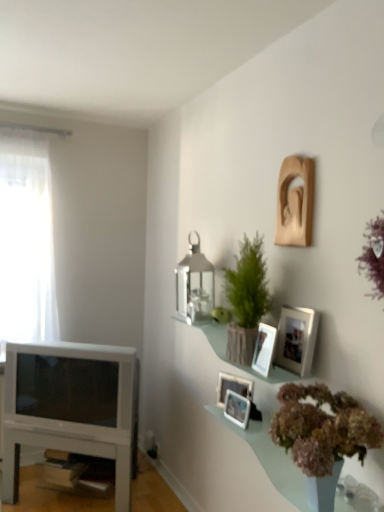
This screenshot has width=384, height=512. What are the coordinates of `silver metallic lantern at upper center` in the screenshot? It's located at (194, 283).

This screenshot has width=384, height=512. Describe the element at coordinates (237, 408) in the screenshot. I see `matte silver picture frame at center, positioned as the 5th picture frame in top-to-bottom order` at that location.

At what (x,y) coordinates should I click in order to perform the action: click on wooden picture frame at upper right, placed as the 3th picture frame when sorted from top to bottom. Please return your answer as a coordinate pair (x, y). Image resolution: width=384 pixels, height=512 pixels. Looking at the image, I should click on (264, 349).

The width and height of the screenshot is (384, 512). Describe the element at coordinates (233, 387) in the screenshot. I see `matte silver picture frame at center, which ranks as the 4th picture frame in top-to-bottom order` at that location.

Image resolution: width=384 pixels, height=512 pixels. What are the coordinates of `wooden sculpture at upper right, which is the 5th picture frame in bottom-to-top order` in the screenshot? It's located at (295, 203).

Find the location of a particular element. This screenshot has height=512, width=384. silver metallic lantern at upper center is located at coordinates (194, 283).

What's the angular difference between wooden picture frame at upper right, placed as the 3th picture frame when sorted from top to bottom, and white glossy table at lower left's facing directions?

60.1 degrees separate the facing orientations of wooden picture frame at upper right, placed as the 3th picture frame when sorted from top to bottom, and white glossy table at lower left.

From a real-world perspective, is wooden picture frame at upper right, which is the 3th picture frame from bottom to top, over white glossy table at lower left?

Yes, from a real-world perspective, wooden picture frame at upper right, which is the 3th picture frame from bottom to top, is above white glossy table at lower left.

Would you say wooden picture frame at upper right, placed as the 3th picture frame when sorted from top to bottom, is outside white glossy table at lower left?

Indeed, wooden picture frame at upper right, placed as the 3th picture frame when sorted from top to bottom, is completely outside white glossy table at lower left.

Is matte silver picture frame at center, positioned as the 5th picture frame in top-to-bottom order, at the back of wooden picture frame at upper right, placed as the 3th picture frame when sorted from top to bottom?

No, wooden picture frame at upper right, placed as the 3th picture frame when sorted from top to bottom, is not facing the opposite direction of matte silver picture frame at center, positioned as the 5th picture frame in top-to-bottom order.

Is wooden picture frame at upper right, which is the 3th picture frame from bottom to top, bigger than matte silver picture frame at center, positioned as the 5th picture frame in top-to-bottom order?

Yes, wooden picture frame at upper right, which is the 3th picture frame from bottom to top, is bigger than matte silver picture frame at center, positioned as the 5th picture frame in top-to-bottom order.

The image size is (384, 512). Find the location of `picture frame that is the 2nd object to the right of the matte silver picture frame at center, positioned as the 5th picture frame in top-to-bottom order, starting at the anchor`. picture frame that is the 2nd object to the right of the matte silver picture frame at center, positioned as the 5th picture frame in top-to-bottom order, starting at the anchor is located at coordinates (264, 349).

Is matte silver picture frame at center, which is counted as the second picture frame, starting from the bottom, shorter than matte silver picture frame at center, positioned as the 5th picture frame in top-to-bottom order?

No.

Locate an element on the screen. picture frame that is the 1st one above the matte silver picture frame at center, marked as the 1th picture frame in a bottom-to-top arrangement (from a real-world perspective) is located at coordinates pyautogui.click(x=233, y=387).

Looking at the image, does matte silver picture frame at center, which ranks as the 4th picture frame in top-to-bottom order, seem bigger or smaller compared to matte silver picture frame at center, marked as the 1th picture frame in a bottom-to-top arrangement?

Considering their sizes, matte silver picture frame at center, which ranks as the 4th picture frame in top-to-bottom order, takes up more space than matte silver picture frame at center, marked as the 1th picture frame in a bottom-to-top arrangement.

From their relative heights in the image, would you say matte silver picture frame at center, marked as the 1th picture frame in a bottom-to-top arrangement, is taller or shorter than green matte plant at upper right, the 2th houseplant positioned from the back?

In the image, matte silver picture frame at center, marked as the 1th picture frame in a bottom-to-top arrangement, appears to be shorter than green matte plant at upper right, the 2th houseplant positioned from the back.

The height and width of the screenshot is (512, 384). Identify the location of the 1st houseplant above when counting from the matte silver picture frame at center, positioned as the 5th picture frame in top-to-bottom order (from the image's perspective). (323, 431).

Considering the positions of point (238, 409) and point (305, 464), is point (238, 409) closer or farther from the camera than point (305, 464)?

Point (238, 409) appears to be farther away from the viewer than point (305, 464).

Considering the sizes of matte silver picture frame at center, positioned as the 5th picture frame in top-to-bottom order, and green matte plant at upper right, the 2th houseplant positioned from the back, in the image, is matte silver picture frame at center, positioned as the 5th picture frame in top-to-bottom order, wider or thinner than green matte plant at upper right, the 2th houseplant positioned from the back,?

Clearly, matte silver picture frame at center, positioned as the 5th picture frame in top-to-bottom order, has less width compared to green matte plant at upper right, the 2th houseplant positioned from the back.

From the image's perspective, is green textured plant at upper center, arranged as the 1th houseplant when viewed from the top, above or below matte silver picture frame at center, which is counted as the second picture frame, starting from the bottom?

Based on their image positions, green textured plant at upper center, arranged as the 1th houseplant when viewed from the top, is located above matte silver picture frame at center, which is counted as the second picture frame, starting from the bottom.

Is green textured plant at upper center, arranged as the 1th houseplant when viewed from the top, spatially inside matte silver picture frame at center, which is counted as the second picture frame, starting from the bottom, or outside of it?

green textured plant at upper center, arranged as the 1th houseplant when viewed from the top, is located beyond the bounds of matte silver picture frame at center, which is counted as the second picture frame, starting from the bottom.

In the image, there is a matte silver picture frame at center, which is counted as the second picture frame, starting from the bottom. At what (x,y) coordinates should I click in order to perform the action: click on houseplant above it (from the image's perspective). Please return your answer as a coordinate pair (x, y). Looking at the image, I should click on (246, 298).

Considering the points (237, 323) and (240, 394), which point is behind, point (237, 323) or point (240, 394)?

The point (240, 394) is farther from the camera.

From the image's perspective, which one is positioned higher, green textured plant at upper center, positioned as the first houseplant in back-to-front order, or silver metallic lantern at upper center?

silver metallic lantern at upper center is shown above in the image.

Is green textured plant at upper center, positioned as the first houseplant in back-to-front order, positioned behind silver metallic lantern at upper center?

No, green textured plant at upper center, positioned as the first houseplant in back-to-front order, is in front of silver metallic lantern at upper center.

Considering the relative sizes of green textured plant at upper center, arranged as the 1th houseplant when viewed from the top, and silver metallic lantern at upper center in the image provided, is green textured plant at upper center, arranged as the 1th houseplant when viewed from the top, smaller than silver metallic lantern at upper center?

Incorrect, green textured plant at upper center, arranged as the 1th houseplant when viewed from the top, is not smaller in size than silver metallic lantern at upper center.

Can you tell me how much silver metallic lantern at upper center and matte silver picture frame at center, which is counted as the second picture frame, starting from the bottom, differ in facing direction?

The angular difference between silver metallic lantern at upper center and matte silver picture frame at center, which is counted as the second picture frame, starting from the bottom, is 22.6 degrees.

From a real-world perspective, is silver metallic lantern at upper center located beneath matte silver picture frame at center, which ranks as the 4th picture frame in top-to-bottom order?

No.

Is silver metallic lantern at upper center positioned with its back to matte silver picture frame at center, which is counted as the second picture frame, starting from the bottom?

No, matte silver picture frame at center, which is counted as the second picture frame, starting from the bottom, is not at the back of silver metallic lantern at upper center.

In terms of width, does silver metallic lantern at upper center look wider or thinner when compared to matte silver picture frame at center, which ranks as the 4th picture frame in top-to-bottom order?

Considering their sizes, silver metallic lantern at upper center looks broader than matte silver picture frame at center, which ranks as the 4th picture frame in top-to-bottom order.

Where is `table beneath the wooden picture frame at upper right, placed as the 3th picture frame when sorted from top to bottom (from a real-world perspective)`? Image resolution: width=384 pixels, height=512 pixels. table beneath the wooden picture frame at upper right, placed as the 3th picture frame when sorted from top to bottom (from a real-world perspective) is located at coordinates (68, 451).

Locate an element on the screen. This screenshot has height=512, width=384. picture frame that is the 2nd object located in front of the matte silver picture frame at center, positioned as the 5th picture frame in top-to-bottom order is located at coordinates (264, 349).

Estimate the real-world distances between objects in this image. Which object is further from wooden photo frame at upper right, arranged as the fourth picture frame when ordered from the bottom, silver metallic lantern at upper center or white glossy television at left?

white glossy television at left is positioned further to the anchor wooden photo frame at upper right, arranged as the fourth picture frame when ordered from the bottom.

When comparing their distances from wooden sculpture at upper right, the 1th picture frame in the top-to-bottom sequence, does matte silver picture frame at center, which ranks as the 4th picture frame in top-to-bottom order, or matte glass shelf at upper right seem further?

Among the two, matte silver picture frame at center, which ranks as the 4th picture frame in top-to-bottom order, is located further to wooden sculpture at upper right, the 1th picture frame in the top-to-bottom sequence.

When comparing their distances from matte silver picture frame at center, which ranks as the 4th picture frame in top-to-bottom order, does matte glass shelf at upper right or wooden picture frame at upper right, placed as the 3th picture frame when sorted from top to bottom, seem closer?

Based on the image, matte glass shelf at upper right appears to be nearer to matte silver picture frame at center, which ranks as the 4th picture frame in top-to-bottom order.

Based on their spatial positions, is white glossy television at left or silver metallic lantern at upper center closer to matte silver picture frame at center, which ranks as the 4th picture frame in top-to-bottom order?

Result: The object closer to matte silver picture frame at center, which ranks as the 4th picture frame in top-to-bottom order, is silver metallic lantern at upper center.

Looking at the image, which one is located further to white glossy table at lower left, matte silver picture frame at center, positioned as the 5th picture frame in top-to-bottom order, or wooden photo frame at upper right, the second picture frame in the top-to-bottom sequence?

wooden photo frame at upper right, the second picture frame in the top-to-bottom sequence, lies further to white glossy table at lower left than the other object.

Looking at the image, which one is located closer to wooden photo frame at upper right, the second picture frame in the top-to-bottom sequence, silver metallic lantern at upper center or green matte plant at upper right, the 2th houseplant positioned from the back?

Among the two, green matte plant at upper right, the 2th houseplant positioned from the back, is located nearer to wooden photo frame at upper right, the second picture frame in the top-to-bottom sequence.

Estimate the real-world distances between objects in this image. Which object is closer to wooden photo frame at upper right, the second picture frame in the top-to-bottom sequence, green textured plant at upper center, arranged as the 2th houseplant when ordered from the bottom, or matte silver picture frame at center, which is counted as the second picture frame, starting from the bottom?

green textured plant at upper center, arranged as the 2th houseplant when ordered from the bottom, lies closer to wooden photo frame at upper right, the second picture frame in the top-to-bottom sequence, than the other object.

Considering their positions, is wooden picture frame at upper right, which is the 3th picture frame from bottom to top, positioned further to matte silver picture frame at center, positioned as the 5th picture frame in top-to-bottom order, than wooden photo frame at upper right, the second picture frame in the top-to-bottom sequence?

Based on the image, wooden photo frame at upper right, the second picture frame in the top-to-bottom sequence, appears to be further to matte silver picture frame at center, positioned as the 5th picture frame in top-to-bottom order.

Locate an element on the screen. houseplant between green matte plant at upper right, positioned as the first houseplant in bottom-to-top order, and white glossy television at left from front to back is located at coordinates (246, 298).

Locate an element on the screen. The height and width of the screenshot is (512, 384). shelf between white glossy television at left and matte silver picture frame at center, positioned as the 5th picture frame in top-to-bottom order, in the horizontal direction is located at coordinates (234, 362).

This screenshot has width=384, height=512. Find the location of `shelf between green matte plant at upper right, positioned as the first houseplant in bottom-to-top order, and silver metallic lantern at upper center in the front-back direction`. shelf between green matte plant at upper right, positioned as the first houseplant in bottom-to-top order, and silver metallic lantern at upper center in the front-back direction is located at coordinates (234, 362).

The width and height of the screenshot is (384, 512). I want to click on houseplant between wooden photo frame at upper right, arranged as the fourth picture frame when ordered from the bottom, and silver metallic lantern at upper center, along the z-axis, so click(x=246, y=298).